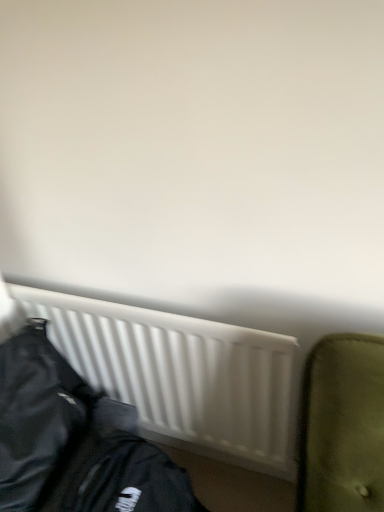
Question: From the image's perspective, relative to white matte radiator at lower center, is black leather jacket at lower left above or below?

Choices:
 (A) below
 (B) above

Answer: (A)

Question: Visually, is black leather jacket at lower left positioned to the left or to the right of white matte radiator at lower center?

Choices:
 (A) left
 (B) right

Answer: (A)

Question: Is black leather jacket at lower left wider or thinner than white matte radiator at lower center?

Choices:
 (A) thin
 (B) wide

Answer: (B)

Question: In terms of size, does white matte radiator at lower center appear bigger or smaller than black leather jacket at lower left?

Choices:
 (A) big
 (B) small

Answer: (A)

Question: From the image's perspective, is white matte radiator at lower center above or below black leather jacket at lower left?

Choices:
 (A) below
 (B) above

Answer: (B)

Question: Considering their positions, is white matte radiator at lower center located in front of or behind black leather jacket at lower left?

Choices:
 (A) front
 (B) behind

Answer: (B)

Question: Considering the positions of point (213, 330) and point (3, 385), is point (213, 330) closer or farther from the camera than point (3, 385)?

Choices:
 (A) closer
 (B) farther

Answer: (A)